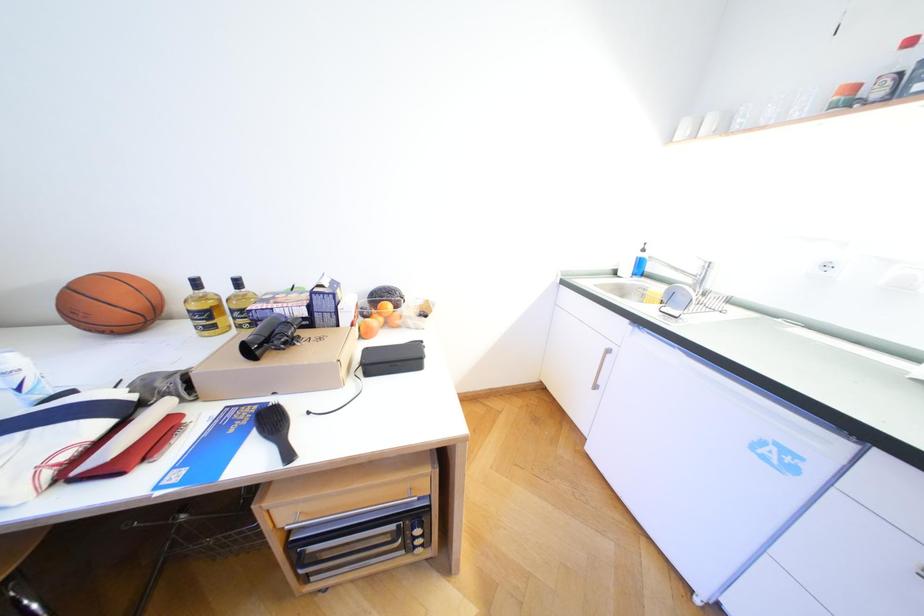
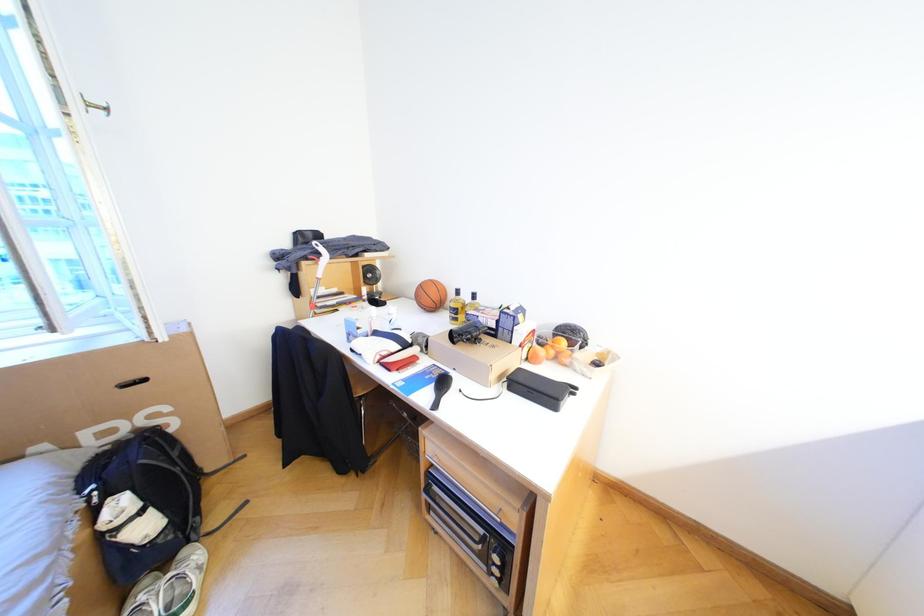
Question: How did the camera likely rotate?

Choices:
 (A) Left
 (B) Right
 (C) Up
 (D) Down

Answer: (A)